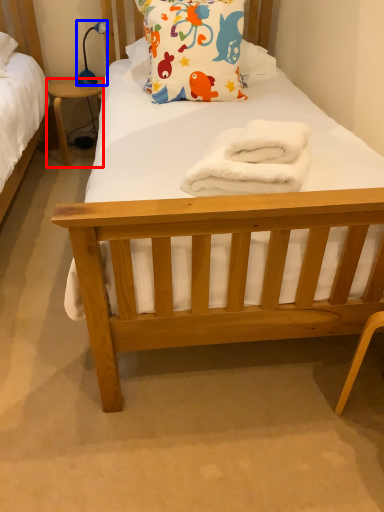
Question: Which object appears farthest to the camera in this image, desk (highlighted by a red box) or lamp (highlighted by a blue box)?

Choices:
 (A) desk
 (B) lamp

Answer: (A)